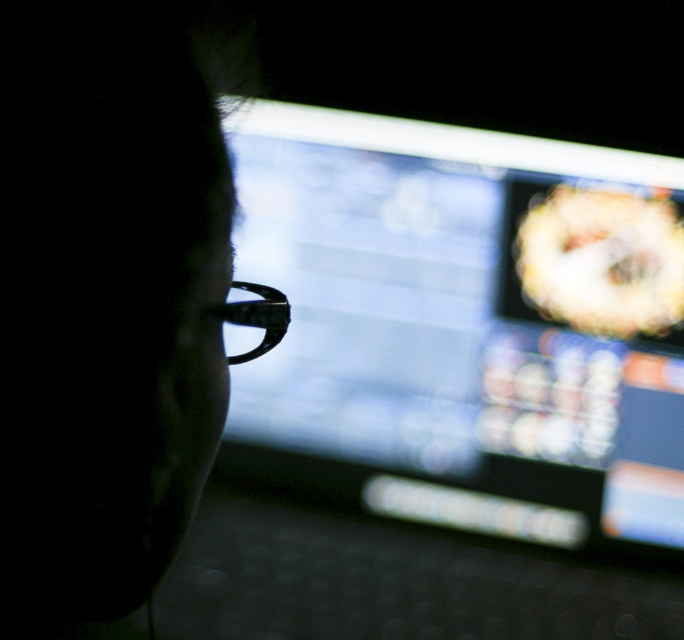
Question: Which of the following is the farthest from the observer?

Choices:
 (A) (184, 163)
 (B) (438, 362)
 (C) (276, 332)

Answer: (B)

Question: Does matte black monitor at center lie behind black matte glasses at left?

Choices:
 (A) no
 (B) yes

Answer: (B)

Question: Is matte black monitor at center to the left of black plastic glasses at center from the viewer's perspective?

Choices:
 (A) yes
 (B) no

Answer: (B)

Question: Which of these objects is positioned closest to the black matte glasses at left?

Choices:
 (A) black plastic glasses at center
 (B) matte black monitor at center

Answer: (A)

Question: Which point is closer to the camera?

Choices:
 (A) (202, 268)
 (B) (358, 390)
 (C) (239, 360)

Answer: (A)

Question: Considering the relative positions of matte black monitor at center and black matte glasses at left in the image provided, where is matte black monitor at center located with respect to black matte glasses at left?

Choices:
 (A) left
 (B) right

Answer: (B)